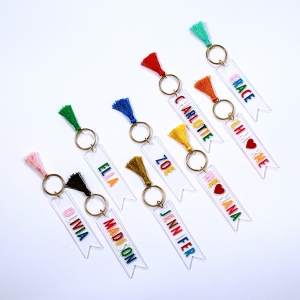
At what (x,y) coordinates should I click in order to perform the action: click on orange tassel. Please return your answer as a coordinate pair (x, y). Looking at the image, I should click on (202, 85).